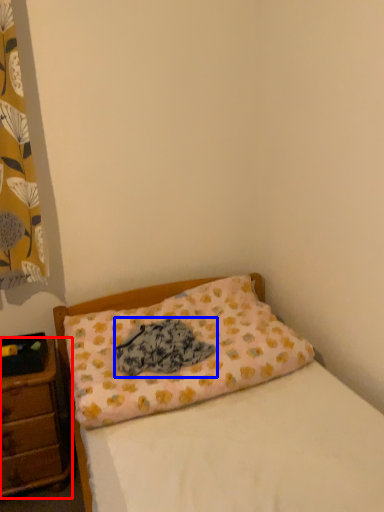
Question: Which object appears farthest to the camera in this image, nightstand (highlighted by a red box) or material (highlighted by a blue box)?

Choices:
 (A) nightstand
 (B) material

Answer: (A)